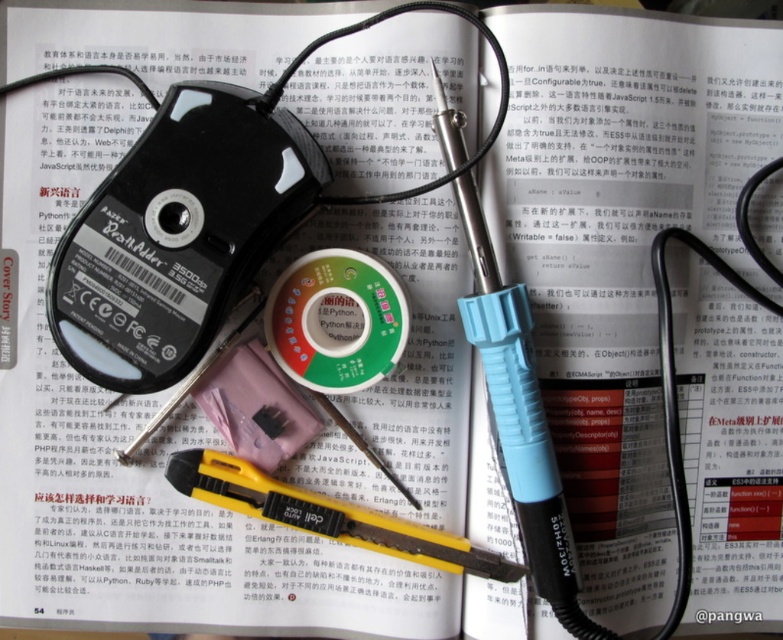
Which is in front, point (114, 241) or point (394, 531)?

Point (114, 241)

Which is behind, point (83, 292) or point (453, 568)?

The point (453, 568) is behind.

Image resolution: width=783 pixels, height=640 pixels. Find the location of `black plastic ipod at center`. black plastic ipod at center is located at coordinates (179, 234).